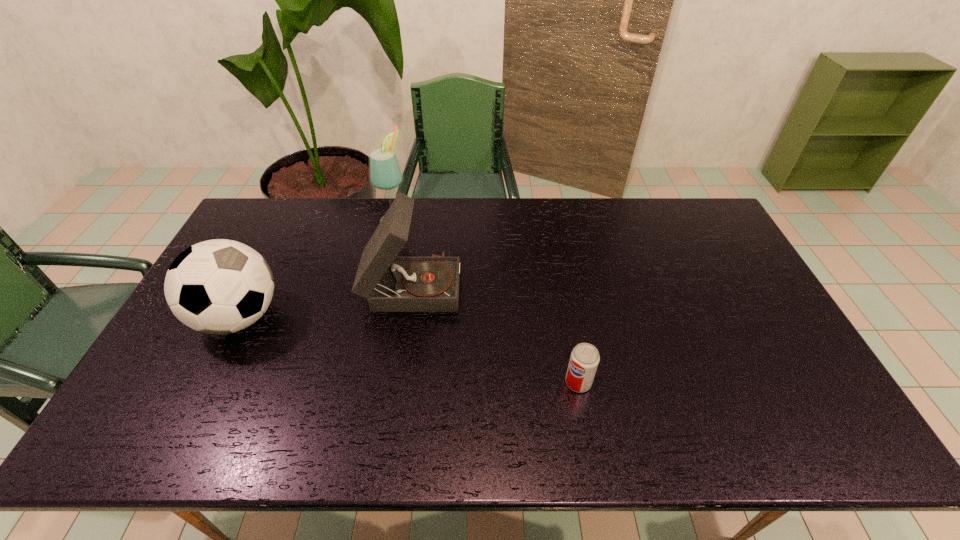
This screenshot has width=960, height=540. Identify the location of free spot located 0.150m on the right of the rightmost object. (650, 382).

Identify the location of object located in the far edge section of the desktop. (385, 173).

At what (x,y) coordinates should I click in order to perform the action: click on object at the left edge. Please return your answer as a coordinate pair (x, y). The image size is (960, 540). Looking at the image, I should click on (221, 286).

The width and height of the screenshot is (960, 540). In order to click on vacant region at the far edge of the desktop in this screenshot , I will do `click(427, 201)`.

At what (x,y) coordinates should I click in order to perform the action: click on vacant region at the near edge of the desktop. Please return your answer as a coordinate pair (x, y). Looking at the image, I should click on (278, 417).

You are a GUI agent. You are given a task and a screenshot of the screen. Output one action in this format:
    pyautogui.click(x=<x>, y=<y>)
    Task: Click on the vacant space at the near right corner
    
    Given the screenshot: What is the action you would take?
    [x=769, y=417]

You are a GUI agent. You are given a task and a screenshot of the screen. Output one action in this format:
    pyautogui.click(x=<x>, y=<y>)
    Task: Click on the free point between the third tallest object and the phonograph_record
    
    Given the screenshot: What is the action you would take?
    pyautogui.click(x=325, y=301)

In order to click on vacant point located between the tallest object and the phonograph_record in this screenshot , I will do `click(403, 252)`.

At what (x,y) coordinates should I click in order to perform the action: click on free space between the alcohol and the soccer ball. Please return your answer as a coordinate pair (x, y). The image size is (960, 540). Looking at the image, I should click on (317, 268).

The height and width of the screenshot is (540, 960). What are the coordinates of `free space between the soccer ball and the alcohol` in the screenshot? It's located at (317, 268).